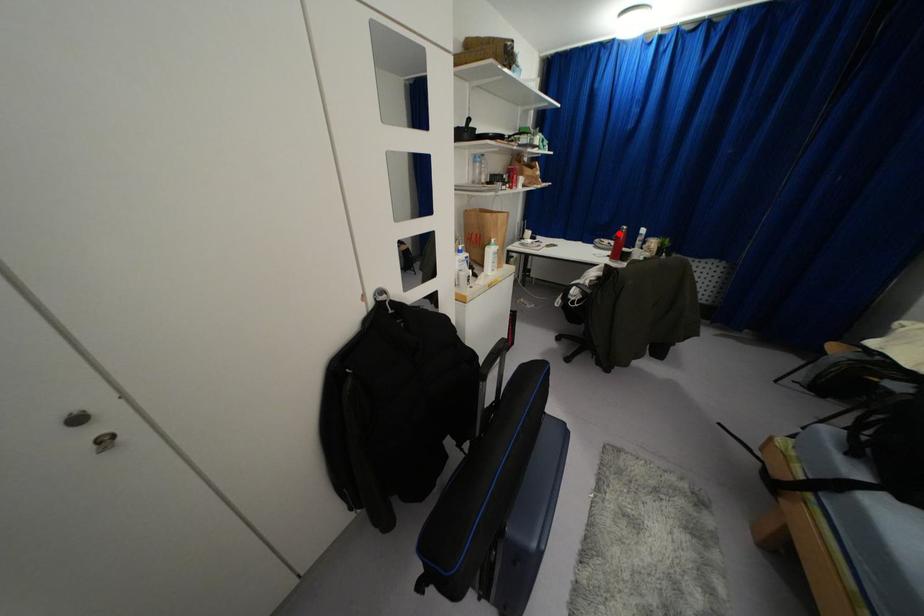
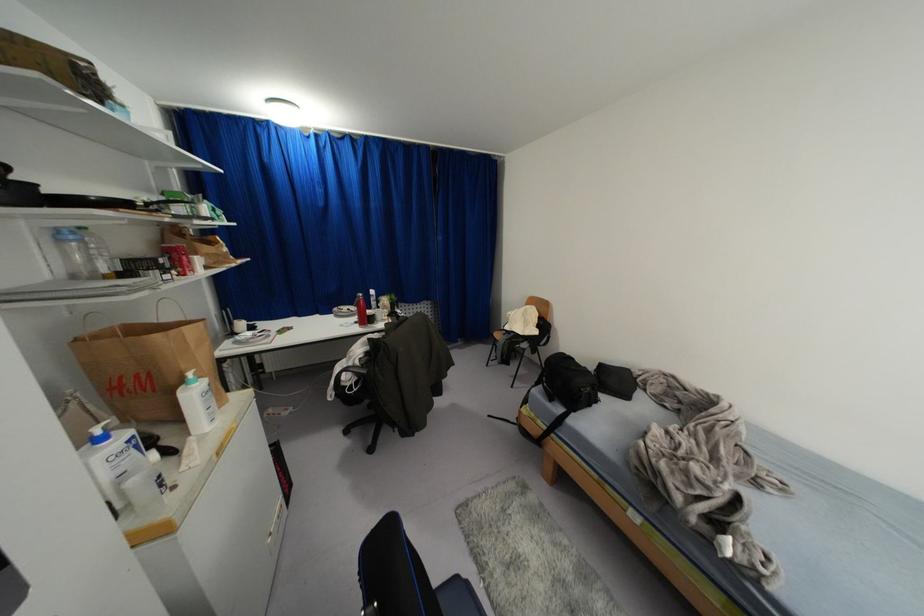
Question: I am providing you with two images of the same scene from different viewpoints. A red point is shown in image1. For the corresponding object point in image2, is it positioned nearer or farther from the camera?

Choices:
 (A) Nearer
 (B) Farther

Answer: (B)